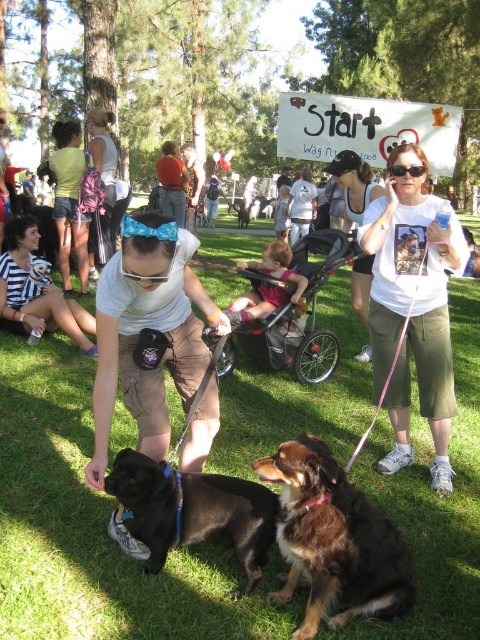
Between point (222, 445) and point (76, 342), which one is positioned behind?

The point (76, 342) is behind.

From the picture: Who is taller, green grass at center or striped fabric shirt at lower left?

With more height is striped fabric shirt at lower left.

Between point (276, 388) and point (35, 333), which one is positioned behind?

The point (35, 333) is more distant.

Locate an element on the screen. green grass at center is located at coordinates (93, 529).

Can you confirm if brown shaggy dog at center is bigger than black plastic stroller at center?

No.

Looking at this image, is brown shaggy dog at center shorter than black plastic stroller at center?

Indeed, brown shaggy dog at center has a lesser height compared to black plastic stroller at center.

Is point (320, 497) closer to camera compared to point (240, 321)?

Yes, point (320, 497) is closer to viewer.

At what (x,y) coordinates should I click in order to perform the action: click on brown shaggy dog at center. Please return your answer as a coordinate pair (x, y). This screenshot has width=480, height=640. Looking at the image, I should click on (334, 540).

Which is below, shiny black dog at center or brown furry dog at center?

shiny black dog at center

In order to click on shiny black dog at center in this screenshot , I will do `click(193, 512)`.

Which is behind, point (183, 513) or point (237, 211)?

The point (237, 211) is more distant.

Identify the location of shiny black dog at center. (193, 512).